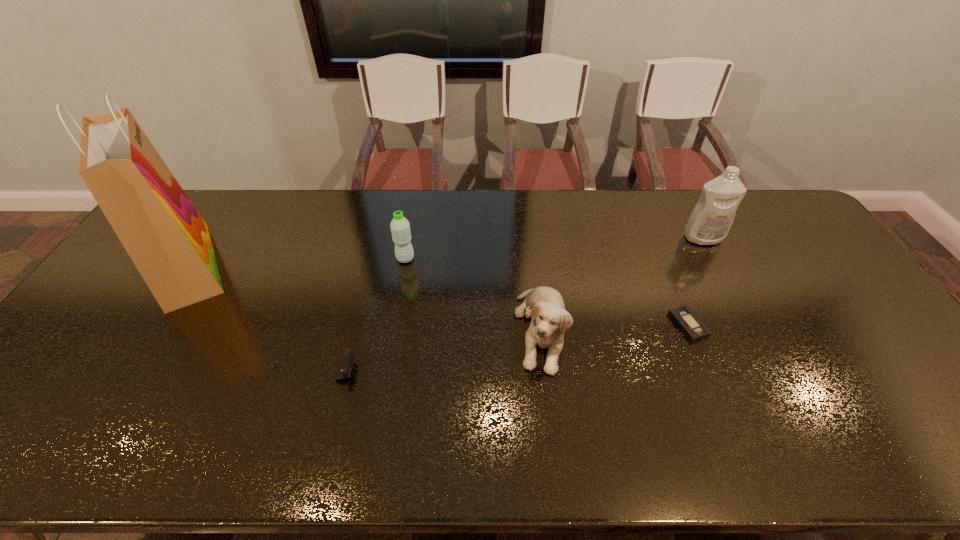
Image resolution: width=960 pixels, height=540 pixels. In order to click on the leftmost object in this screenshot , I will do `click(168, 241)`.

Find the location of a particular element. shopping bag is located at coordinates (168, 241).

Locate an element on the screen. The width and height of the screenshot is (960, 540). the rightmost object is located at coordinates (709, 223).

The width and height of the screenshot is (960, 540). Find the location of `the second tallest object`. the second tallest object is located at coordinates (709, 223).

At what (x,y) coordinates should I click in order to perform the action: click on water bottle. Please return your answer as a coordinate pair (x, y). Image resolution: width=960 pixels, height=540 pixels. Looking at the image, I should click on (400, 227).

Where is `the fourth shortest object`? Image resolution: width=960 pixels, height=540 pixels. the fourth shortest object is located at coordinates (400, 227).

Find the location of a particular element. Image resolution: width=960 pixels, height=540 pixels. the fourth object from left to right is located at coordinates (549, 320).

Identify the location of puppy. Image resolution: width=960 pixels, height=540 pixels. 549,320.

Locate an element on the screen. This screenshot has height=540, width=960. webcam is located at coordinates (344, 367).

This screenshot has height=540, width=960. In order to click on the fifth tallest object in this screenshot , I will do 344,367.